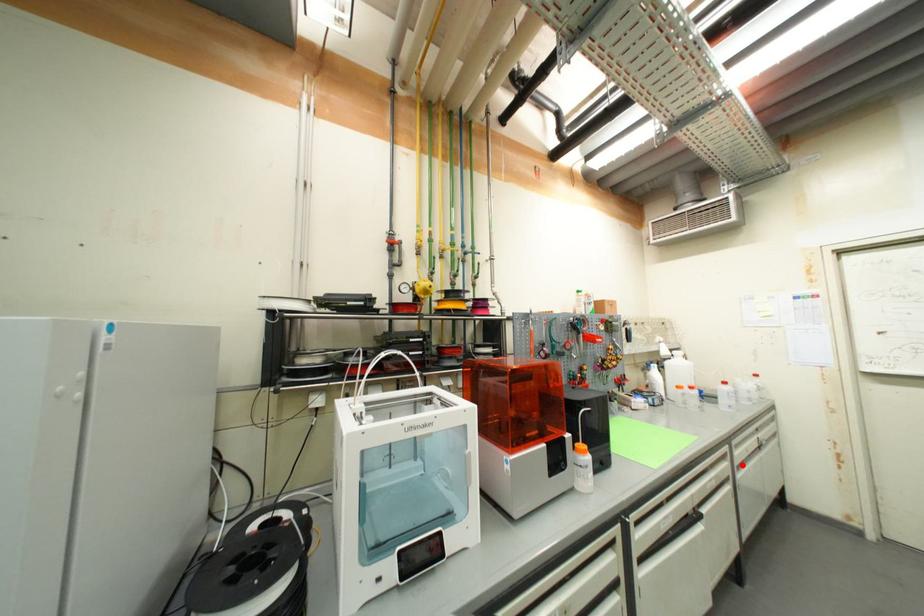
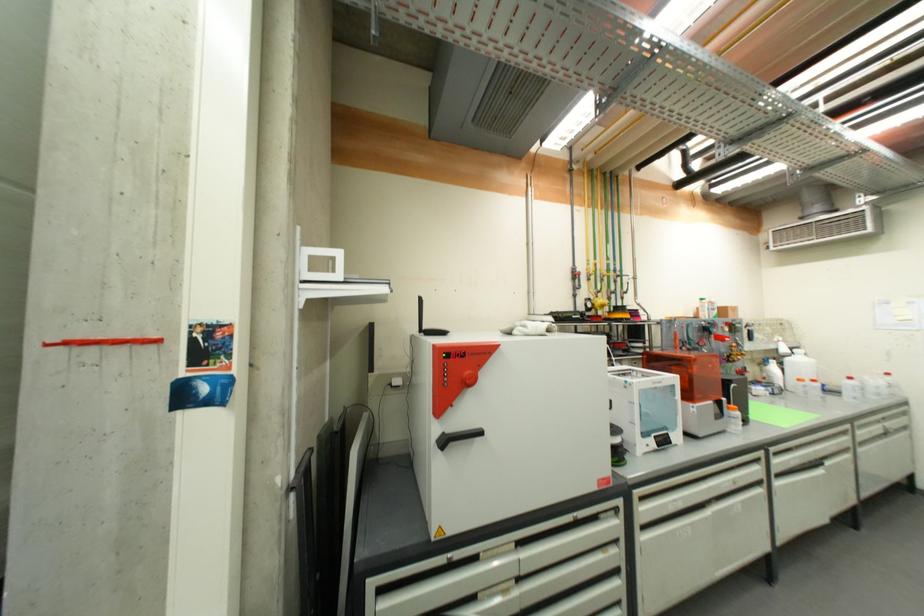
Locate, in the second image, the point that corresponds to the highlighted location in the first image.

(864, 442)